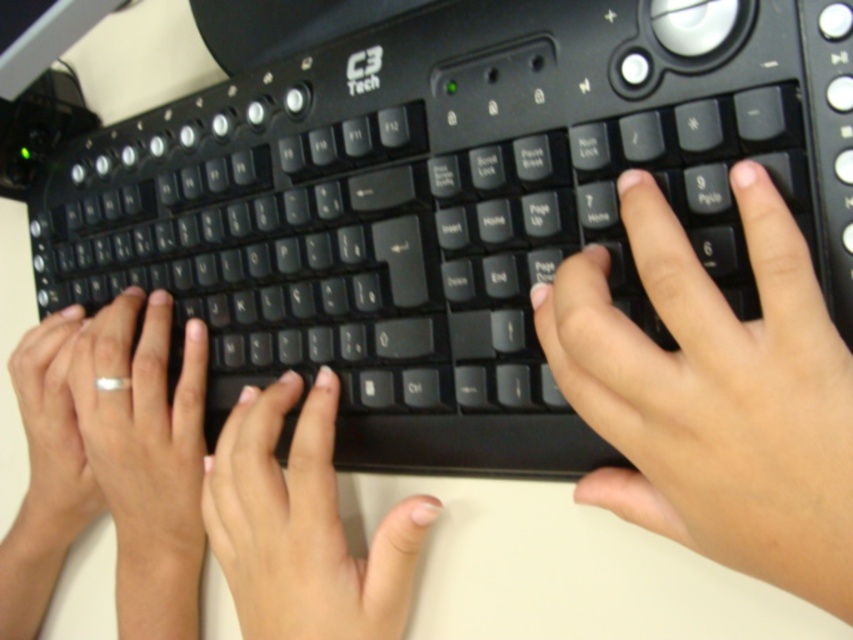
You are a graphic designer working on a project and need to place a watermark on the keyboard image. The watermark must be placed exactly where the black matte hand at right is located, which is at point (715, 394). Can you confirm the location of the black matte hand at right on the keyboard?

The black matte hand at right is located at point (715, 394) on the keyboard.

You are designing a desk layout and need to place a computer monitor directly above the black matte keyboard at center. According to the image, where should you position the monitor relative to the keyboard?

The black matte keyboard at center is located at point (450, 205). To place the computer monitor directly above it, position the monitor at the same horizontal coordinate 0.323 and a lower vertical coordinate, since the vertical axis typically decreases as you move upward in such coordinate systems.